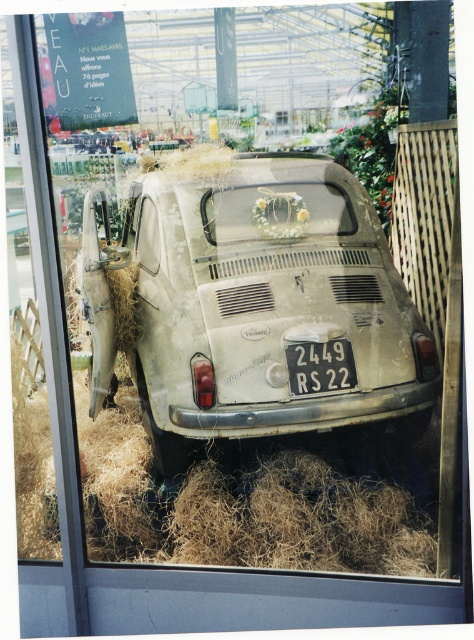
Question: Is dirty white car at center positioned at the back of white plastic license plate at center?

Choices:
 (A) no
 (B) yes

Answer: (A)

Question: Is dirty white car at center smaller than white plastic license plate at center?

Choices:
 (A) yes
 (B) no

Answer: (B)

Question: Is the position of dirty white car at center less distant than that of white plastic license plate at center?

Choices:
 (A) no
 (B) yes

Answer: (B)